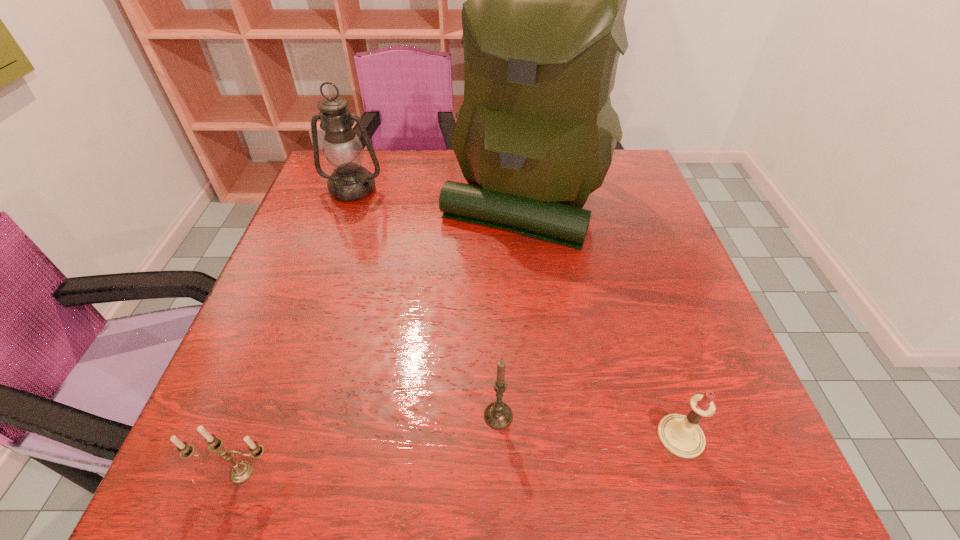
Identify the location of vacant space located 0.130m on the left of the rightmost candle. (580, 436).

Where is `backpack situated at the far edge`? This screenshot has height=540, width=960. backpack situated at the far edge is located at coordinates (543, 26).

Find the location of a particular element. This screenshot has width=960, height=540. oil lamp that is at the far edge is located at coordinates (343, 150).

At what (x,y) coordinates should I click in order to perform the action: click on oil lamp situated at the left edge. Please return your answer as a coordinate pair (x, y). Looking at the image, I should click on (343, 150).

The image size is (960, 540). I want to click on candle that is at the left edge, so click(241, 471).

The image size is (960, 540). Find the location of `backpack that is at the right edge`. backpack that is at the right edge is located at coordinates (543, 26).

This screenshot has width=960, height=540. I want to click on candle at the right edge, so click(681, 435).

Where is `object at the far left corner`? object at the far left corner is located at coordinates (343, 150).

Find the location of `object positioned at the near left corner`. object positioned at the near left corner is located at coordinates (241, 471).

What are the coordinates of `object that is at the far right corner` in the screenshot? It's located at (543, 26).